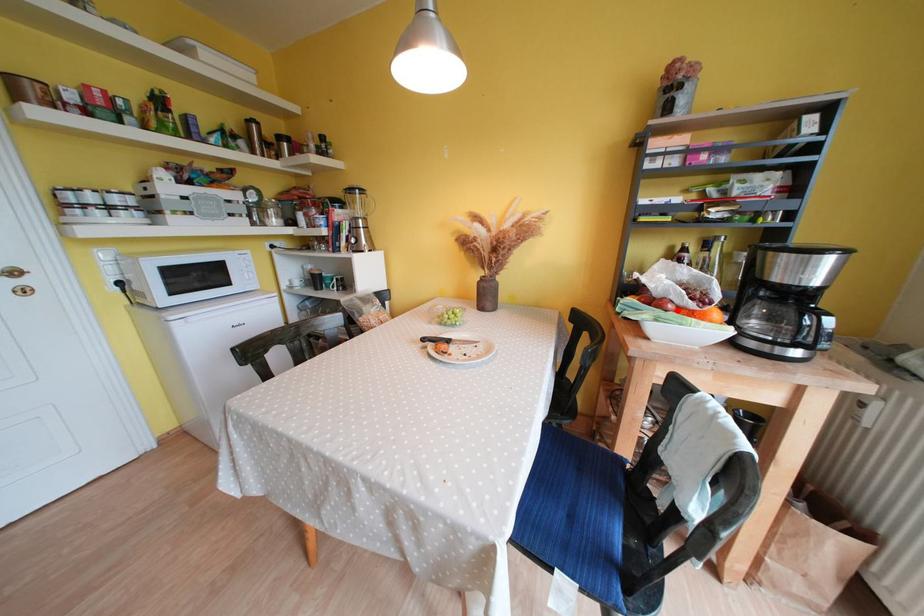
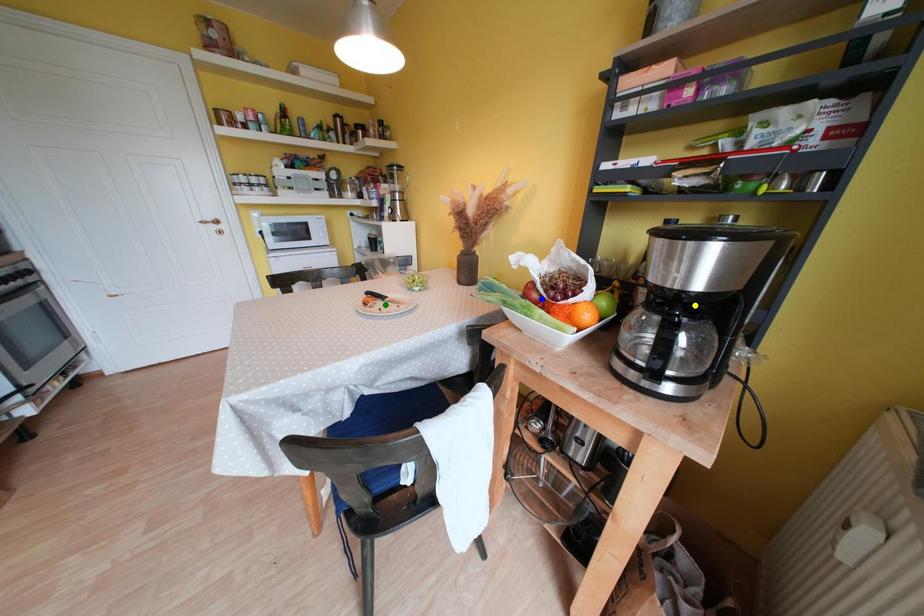
Question: I am providing you with two images of the same scene from different viewpoints. A red point is marked on the first image. You are given multiple points on the second image. Which point in image 2 represents the same 3d spot as the red point in image 1?

Choices:
 (A) blue point
 (B) yellow point
 (C) green point

Answer: (A)